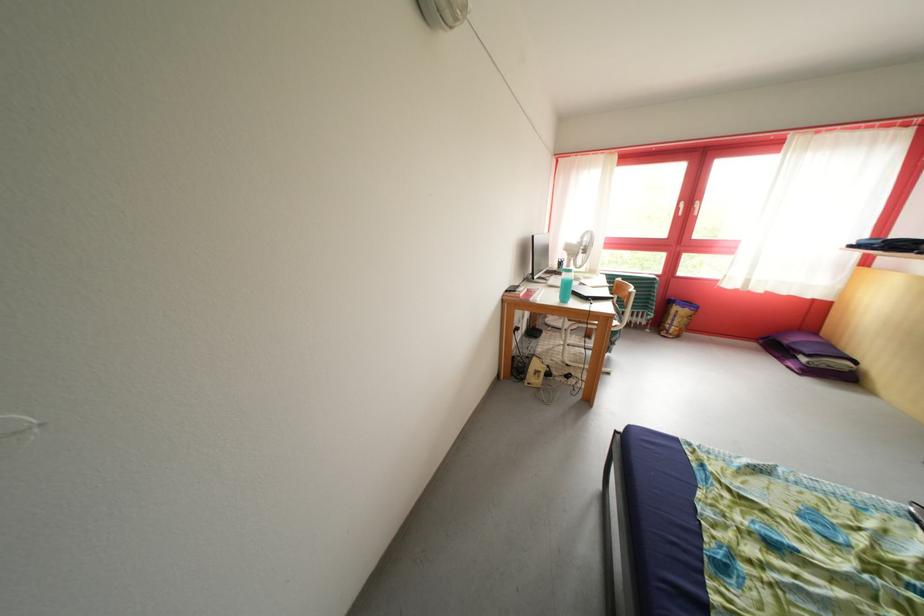
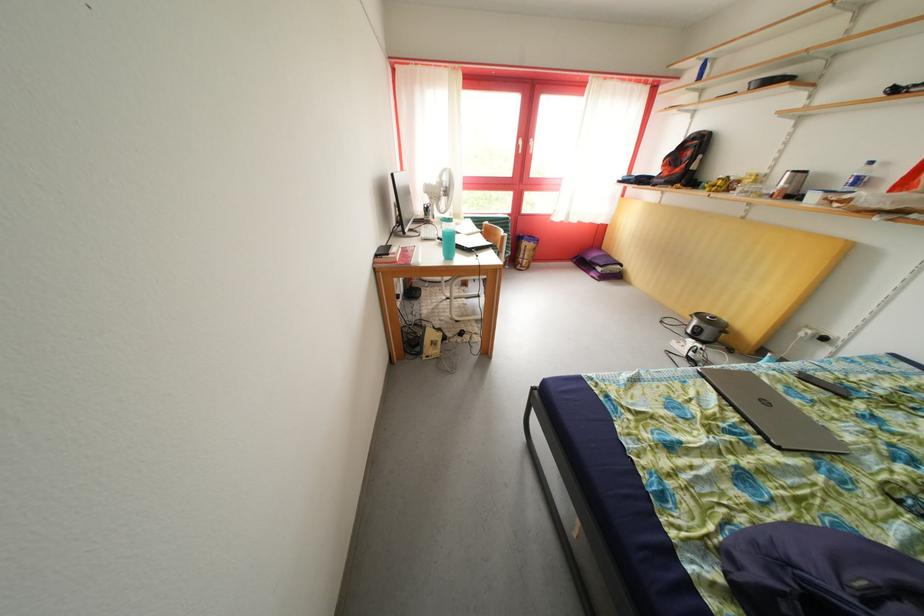
The point at (584, 261) is marked in the first image. Where is the corresponding point in the second image?

(446, 204)